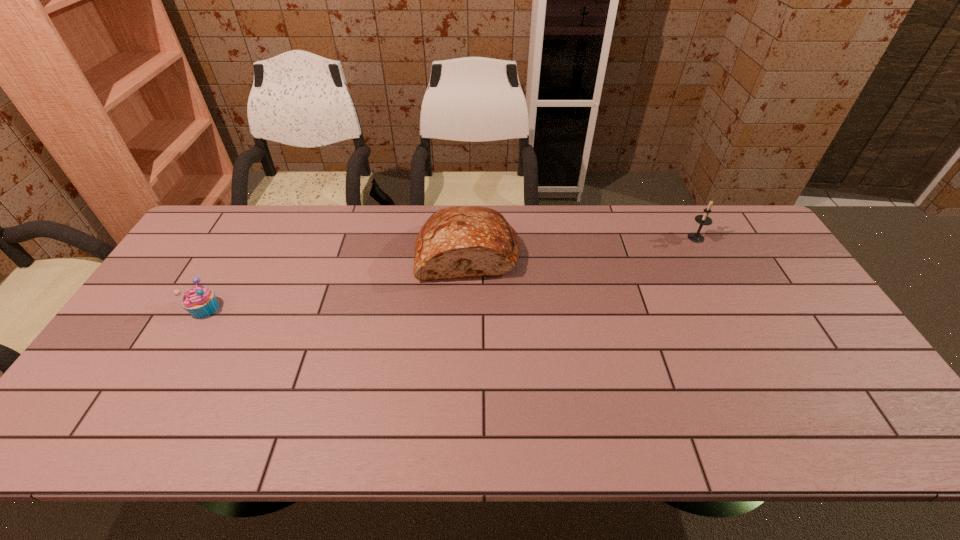
The width and height of the screenshot is (960, 540). What are the coordinates of `the second object from right to left` in the screenshot? It's located at (462, 241).

Locate an element on the screen. This screenshot has width=960, height=540. the rightmost object is located at coordinates (701, 219).

The height and width of the screenshot is (540, 960). Identify the location of the nearest object. (199, 301).

Identify the location of the leftmost object. The image size is (960, 540). (199, 301).

I want to click on blank area located 0.330m at the sliced front of the second object from right to left, so click(464, 382).

Where is `vacant space located 0.200m on the right of the rightmost object`? The width and height of the screenshot is (960, 540). vacant space located 0.200m on the right of the rightmost object is located at coordinates (765, 238).

At what (x,y) coordinates should I click in order to perform the action: click on blank area located on the back of the muffin. Please return your answer as a coordinate pair (x, y). Looking at the image, I should click on (234, 258).

Find the location of a particular element. Image resolution: width=960 pixels, height=540 pixels. bread that is at the far edge is located at coordinates (462, 241).

Identify the location of candle holder that is at the far edge. This screenshot has height=540, width=960. (701, 219).

Where is `object that is at the left edge`? The height and width of the screenshot is (540, 960). object that is at the left edge is located at coordinates (199, 301).